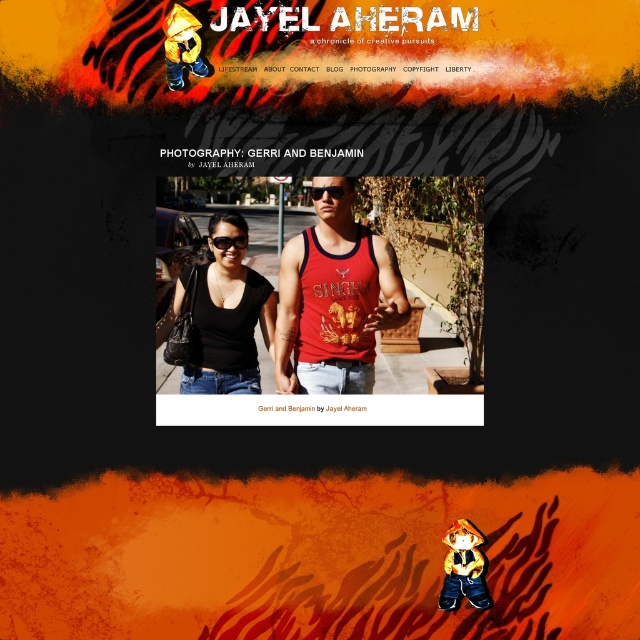
Does matte red tank top at center come in front of black plastic sunglasses at center?

That is False.

Identify the location of matte red tank top at center. (333, 300).

The height and width of the screenshot is (640, 640). Identify the location of matte red tank top at center. (x=333, y=300).

Can you confirm if matte red tank top at center is taller than black plastic goggles at center?

Correct, matte red tank top at center is much taller as black plastic goggles at center.

Who is taller, matte red tank top at center or black plastic goggles at center?

With more height is matte red tank top at center.

Image resolution: width=640 pixels, height=640 pixels. In order to click on matte red tank top at center in this screenshot , I will do `click(333, 300)`.

Can you confirm if red cotton singh vest at center is taller than black plastic sunglasses at center?

Yes, red cotton singh vest at center is taller than black plastic sunglasses at center.

Is red cotton singh vest at center to the left of black plastic sunglasses at center from the viewer's perspective?

In fact, red cotton singh vest at center is to the right of black plastic sunglasses at center.

Describe the element at coordinates (337, 301) in the screenshot. The image size is (640, 640). I see `red cotton singh vest at center` at that location.

I want to click on red cotton singh vest at center, so click(x=337, y=301).